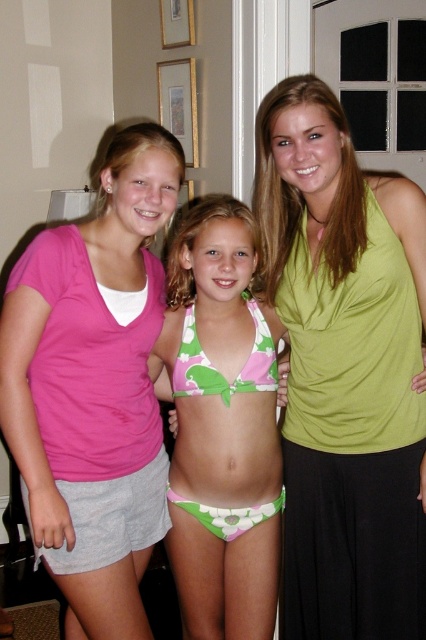
Question: Is green fabric tank top at upper right closer to the viewer compared to floral bikini bottom at center?

Choices:
 (A) no
 (B) yes

Answer: (B)

Question: Which point is closer to the camera?

Choices:
 (A) green floral bikini at center
 (B) pink cotton t-shirt at left

Answer: (B)

Question: Can you confirm if green fabric tank top at upper right is positioned below floral bikini bottom at center?

Choices:
 (A) yes
 (B) no

Answer: (B)

Question: Which point is closer to the camera?

Choices:
 (A) floral bikini bottom at center
 (B) green fabric tank top at upper right
 (C) gray cotton shorts at lower left
 (D) pink cotton t-shirt at left

Answer: (D)

Question: Among these objects, which one is nearest to the camera?

Choices:
 (A) green fabric tank top at upper right
 (B) pink cotton t-shirt at left

Answer: (B)

Question: Is floral bikini bottom at center thinner than green floral bikini at center?

Choices:
 (A) yes
 (B) no

Answer: (B)